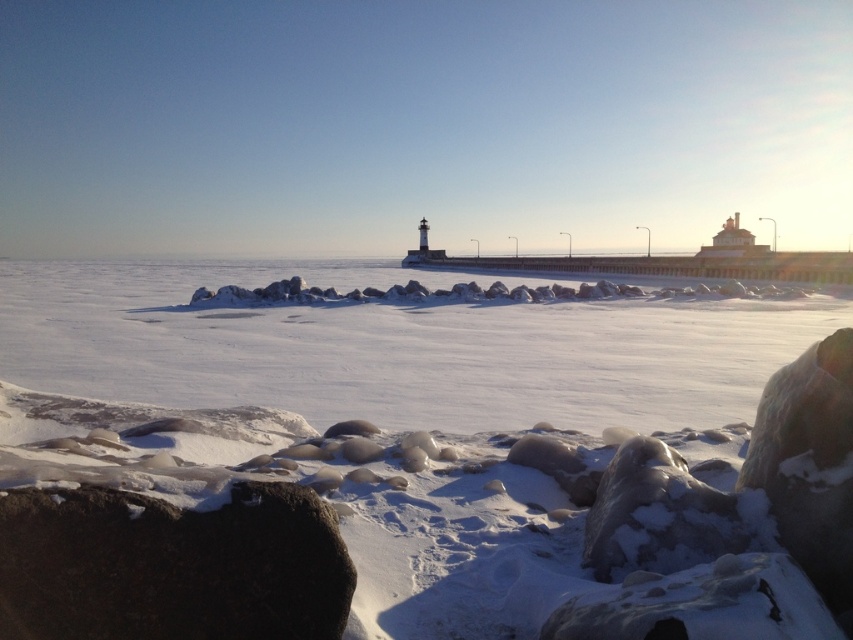
Is dark gray rock at lower left thinner than smooth gray rock at lower center?

No, dark gray rock at lower left is not thinner than smooth gray rock at lower center.

Is point (91, 502) positioned after point (762, 547)?

No, it is not.

Identify the location of dark gray rock at lower left. (171, 564).

This screenshot has width=853, height=640. What do you see at coordinates (442, 445) in the screenshot? I see `white matte snow at center` at bounding box center [442, 445].

Is white matte snow at center positioned before dark gray rock at lower left?

No.

I want to click on white matte snow at center, so [x=442, y=445].

This screenshot has height=640, width=853. Find the location of `white matte snow at center`. white matte snow at center is located at coordinates (442, 445).

Is white matte snow at center wider than smooth gray rock at lower center?

Yes.

Does point (229, 324) come behind point (735, 548)?

That is True.

Identify the location of white matte snow at center. This screenshot has height=640, width=853. (442, 445).

You are a GUI agent. You are given a task and a screenshot of the screen. Output one action in this format:
    pyautogui.click(x=<x>, y=<y>)
    Task: Click on the white matte snow at center
    
    Given the screenshot: What is the action you would take?
    pyautogui.click(x=442, y=445)